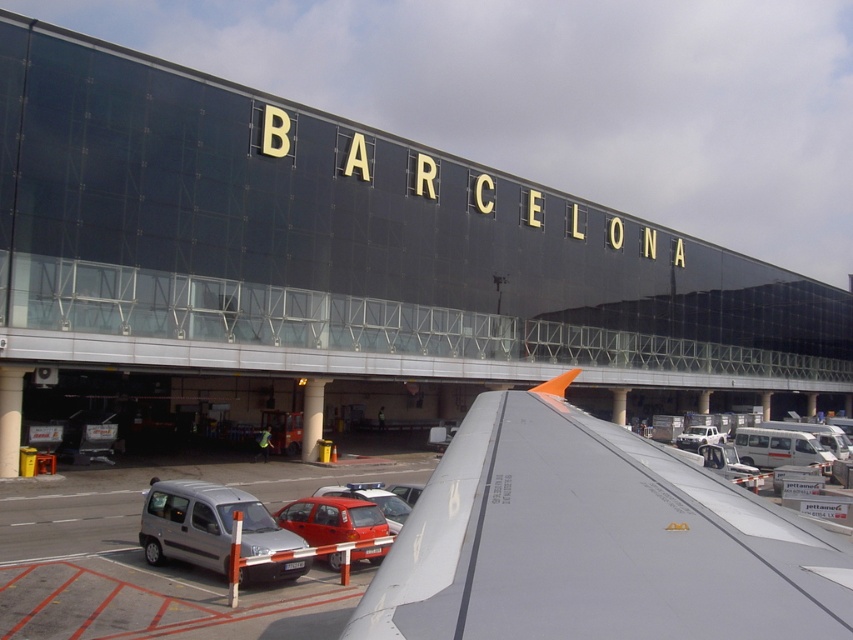
You are a photographer standing at the Barcelona Airport terminal. You notice two points marked on your camera screen. The first point is at coordinates point (x=316, y=456) and the second is at point (x=679, y=435). Which point will appear larger in your photo?

→ Point (x=316, y=456) is closer to the camera than point (x=679, y=435), so it will appear larger in the photo.